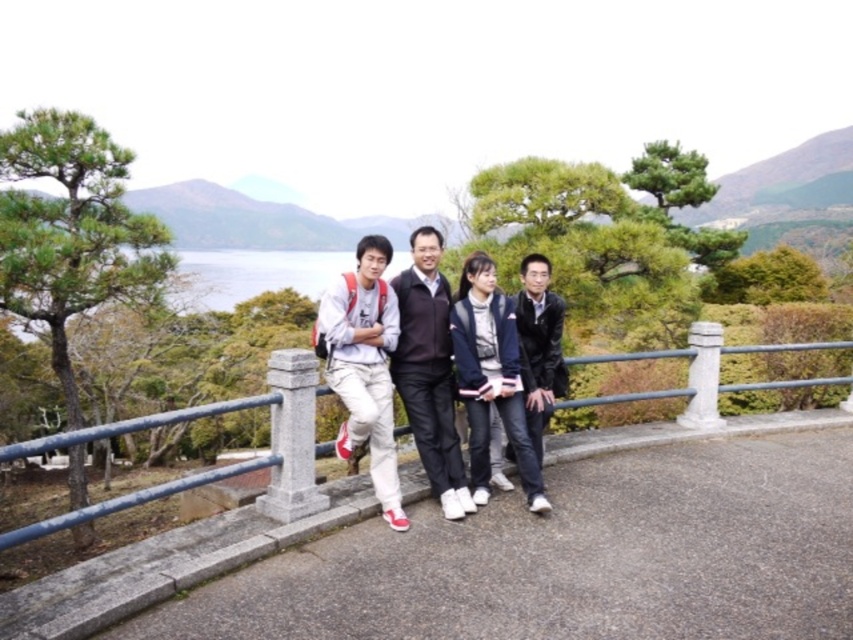
You are a photographer trying to capture the group of people and the scenic view behind them. Based on the scene, which object, the dark brown leather jacket at center or the transparent water at center, would appear closer to the camera in the photo?

The dark brown leather jacket at center appears closer to the camera than the transparent water at center because it is shorter in the scene.

You are a fashion designer observing the group of people. You need to determine the spatial relationship between the dark brown leather jacket at center and the black leather jacket at right. Which jacket is located lower in the image?

The dark brown leather jacket at center is positioned under the black leather jacket at right, meaning it is lower in the image.

Based on the scene, which object is positioned to the right of the other? The dark brown leather jacket at center or the transparent water at center?

The dark brown leather jacket at center is to the right of transparent water at center according to the description.